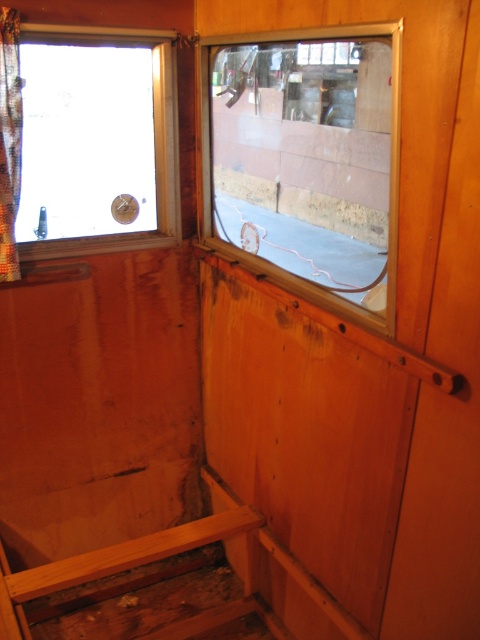
Does point (250, 104) lie in front of point (168, 148)?

Yes, it is.

Does point (265, 90) come closer to viewer compared to point (135, 51)?

Yes.

Where is `clear glass window at center`? The image size is (480, 640). clear glass window at center is located at coordinates (307, 157).

Who is positioned more to the right, clear glass window at center or satin fabric curtain at left?

clear glass window at center is more to the right.

Is clear glass window at center to the left of satin fabric curtain at left from the viewer's perspective?

Incorrect, clear glass window at center is not on the left side of satin fabric curtain at left.

Is point (342, 90) closer to camera compared to point (13, 70)?

Yes, it is.

Locate an element on the screen. clear glass window at center is located at coordinates (307, 157).

Who is more forward, (155, 116) or (14, 83)?

Point (14, 83) is more forward.

Can you confirm if clear glass window at upper left is positioned to the left of satin fabric curtain at left?

Indeed, clear glass window at upper left is positioned on the left side of satin fabric curtain at left.

Does point (82, 228) come behind point (17, 44)?

Yes, point (82, 228) is behind point (17, 44).

This screenshot has width=480, height=640. Find the location of `clear glass window at upper left`. clear glass window at upper left is located at coordinates (97, 140).